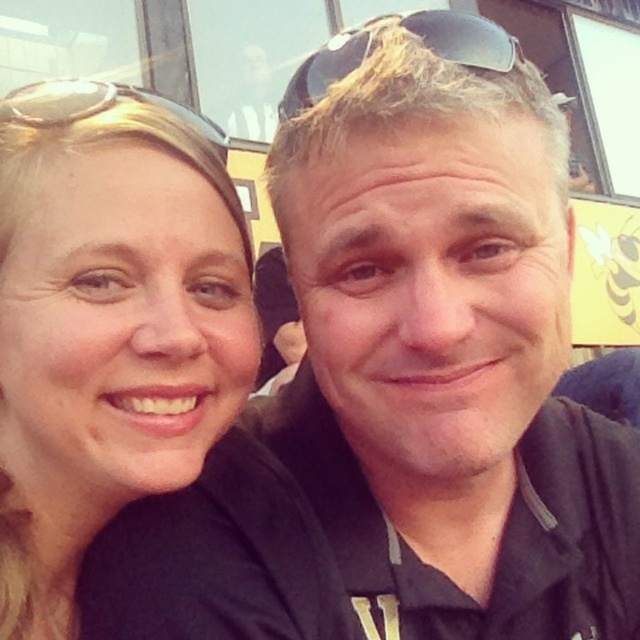
Question: Is sunglasses at center to the left of gold reflective sunglasses at upper left from the viewer's perspective?

Choices:
 (A) no
 (B) yes

Answer: (A)

Question: Estimate the real-world distances between objects in this image. Which object is closer to the gold reflective sunglasses at upper left?

Choices:
 (A) matte blonde hair at left
 (B) sunglasses at center

Answer: (B)

Question: Which point is closer to the camera taking this photo?

Choices:
 (A) (369, 51)
 (B) (237, 388)
 (C) (90, 109)

Answer: (A)

Question: Is sunglasses at center below gold reflective sunglasses at upper left?

Choices:
 (A) yes
 (B) no

Answer: (B)

Question: Among these objects, which one is farthest from the camera?

Choices:
 (A) gold reflective sunglasses at upper left
 (B) matte blonde hair at left
 (C) sunglasses at center

Answer: (A)

Question: Does sunglasses at center appear over gold reflective sunglasses at upper left?

Choices:
 (A) no
 (B) yes

Answer: (B)